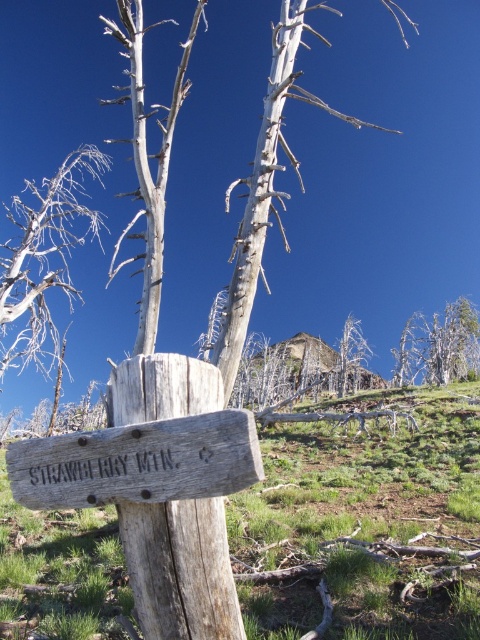
Question: Which object is farther from the camera taking this photo?

Choices:
 (A) gray wood tree at upper right
 (B) gray wood tree at left
 (C) dead wood tree at center

Answer: (A)

Question: Observing the image, what is the correct spatial positioning of gray wood tree at left in reference to gray wood tree at upper right?

Choices:
 (A) below
 (B) above

Answer: (B)

Question: Can you confirm if green rough wood sign at center is positioned above gray wood tree at left?

Choices:
 (A) no
 (B) yes

Answer: (A)

Question: Among these points, which one is nearest to the camera?

Choices:
 (A) (11, 202)
 (B) (240, 307)

Answer: (B)

Question: Which point appears farthest from the camera in this image?

Choices:
 (A) (227, 460)
 (B) (180, 552)

Answer: (B)

Question: Does weathered wood sign at center have a lesser width compared to gray wood tree at upper right?

Choices:
 (A) no
 (B) yes

Answer: (B)